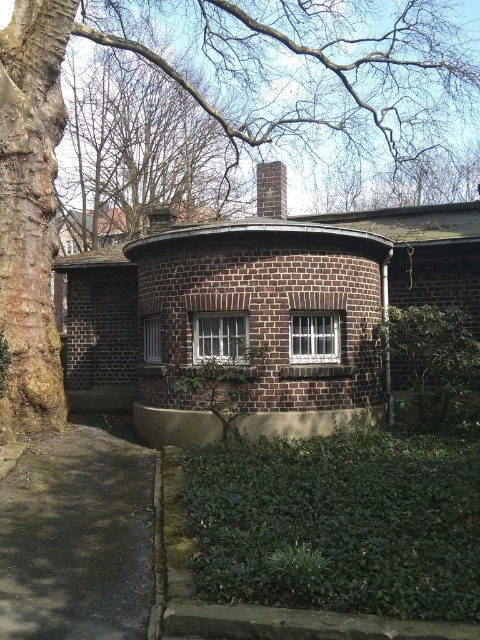
Based on the photo, who is positioned more to the left, green leafy hedge at lower center or brick chimney at upper center?

Positioned to the left is brick chimney at upper center.

Measure the distance between point (262, 458) and camera.

Point (262, 458) and camera are 8.54 meters apart from each other.

Does point (384, 561) come behind point (277, 179)?

No.

I want to click on green leafy hedge at lower center, so click(340, 522).

Consider the image. Is green leafy hedge at center taller than brick chimney at upper center?

In fact, green leafy hedge at center may be shorter than brick chimney at upper center.

Between green leafy hedge at center and brick chimney at upper center, which one is positioned higher?

brick chimney at upper center is above.

Is point (240, 358) more distant than point (274, 173)?

No, it is in front of (274, 173).

What are the coordinates of `green leafy hedge at center` in the screenshot? It's located at (224, 381).

Which is more to the right, brown rough bark tree at left or green leafy hedge at center?

Positioned to the right is brown rough bark tree at left.

Is brown rough bark tree at left taller than green leafy hedge at center?

Correct, brown rough bark tree at left is much taller as green leafy hedge at center.

You are a GUI agent. You are given a task and a screenshot of the screen. Output one action in this format:
    pyautogui.click(x=<x>, y=<y>)
    Task: Click on the brown rough bark tree at left
    The height and width of the screenshot is (640, 480).
    Given the screenshot: What is the action you would take?
    pyautogui.click(x=261, y=310)

Find the location of a particular element. brown rough bark tree at left is located at coordinates (261, 310).